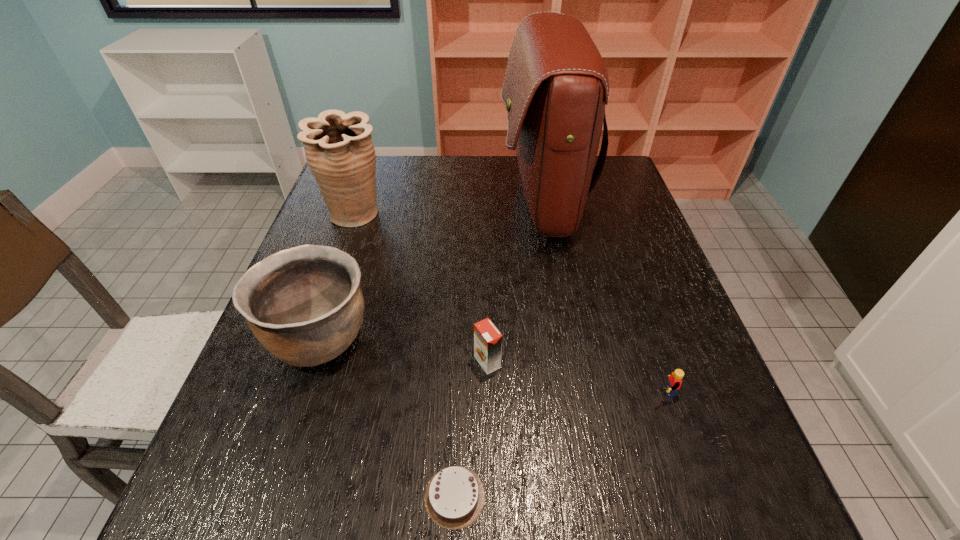
At what (x,y) coordinates should I click in order to perform the action: click on object that is at the near edge. Please return your answer as a coordinate pair (x, y). This screenshot has width=960, height=540. Looking at the image, I should click on (454, 498).

Locate an element on the screen. The width and height of the screenshot is (960, 540). urn located in the left edge section of the desktop is located at coordinates (339, 150).

At what (x,y) coordinates should I click in order to perform the action: click on pottery present at the left edge. Please return your answer as a coordinate pair (x, y). This screenshot has height=540, width=960. Looking at the image, I should click on point(305,305).

I want to click on satchel at the right edge, so click(x=556, y=85).

This screenshot has width=960, height=540. Find the location of `Lego located at the right edge`. Lego located at the right edge is located at coordinates [x=674, y=381].

Find the location of a particular element. The image size is (960, 540). object that is at the far left corner is located at coordinates (339, 150).

This screenshot has width=960, height=540. I want to click on object that is at the far right corner, so click(x=556, y=85).

The height and width of the screenshot is (540, 960). In the image, there is a desktop. Identify the location of free space at the far edge. (475, 181).

Where is `free space at the left edge of the desktop`? free space at the left edge of the desktop is located at coordinates (273, 443).

Where is `vacant area at the right edge of the desktop`? vacant area at the right edge of the desktop is located at coordinates (624, 250).